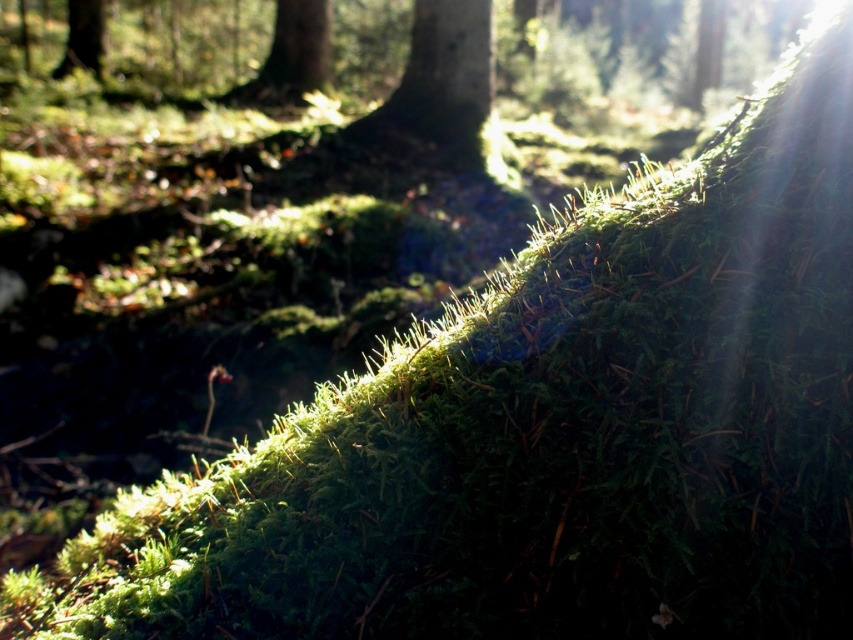
Question: Does green mossy tree trunk at center have a smaller size compared to green mossy tree at upper left?

Choices:
 (A) yes
 (B) no

Answer: (B)

Question: Which object appears closest to the camera in this image?

Choices:
 (A) green mossy tree trunk at center
 (B) green mossy tree at upper left

Answer: (A)

Question: Can you confirm if green mossy tree trunk at upper center is positioned below green mossy tree at upper left?

Choices:
 (A) no
 (B) yes

Answer: (B)

Question: Which object is positioned farthest from the green mossy tree at upper left?

Choices:
 (A) green mossy tree trunk at center
 (B) green mossy tree trunk at upper center

Answer: (A)

Question: Can you confirm if green mossy tree trunk at upper center is wider than green mossy tree at upper left?

Choices:
 (A) yes
 (B) no

Answer: (A)

Question: Which object appears closest to the camera in this image?

Choices:
 (A) green mossy tree trunk at center
 (B) green mossy tree trunk at upper center

Answer: (A)